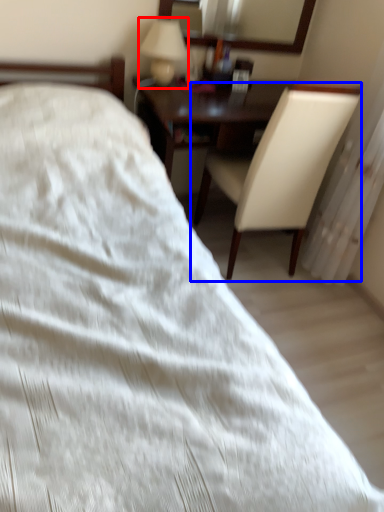
Question: Which object is closer to the camera taking this photo, table lamp (highlighted by a red box) or chair (highlighted by a blue box)?

Choices:
 (A) table lamp
 (B) chair

Answer: (B)